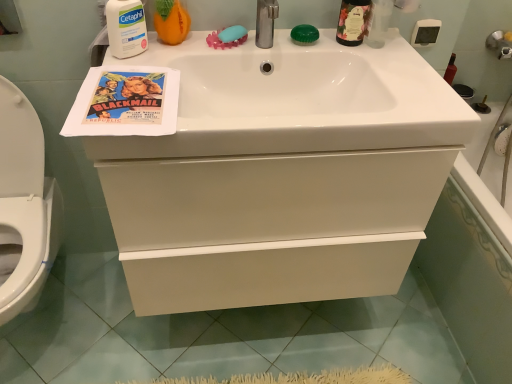
The width and height of the screenshot is (512, 384). Find the location of `free region under matte paper poster at upper left (from a real-world perspective)`. free region under matte paper poster at upper left (from a real-world perspective) is located at coordinates (126, 100).